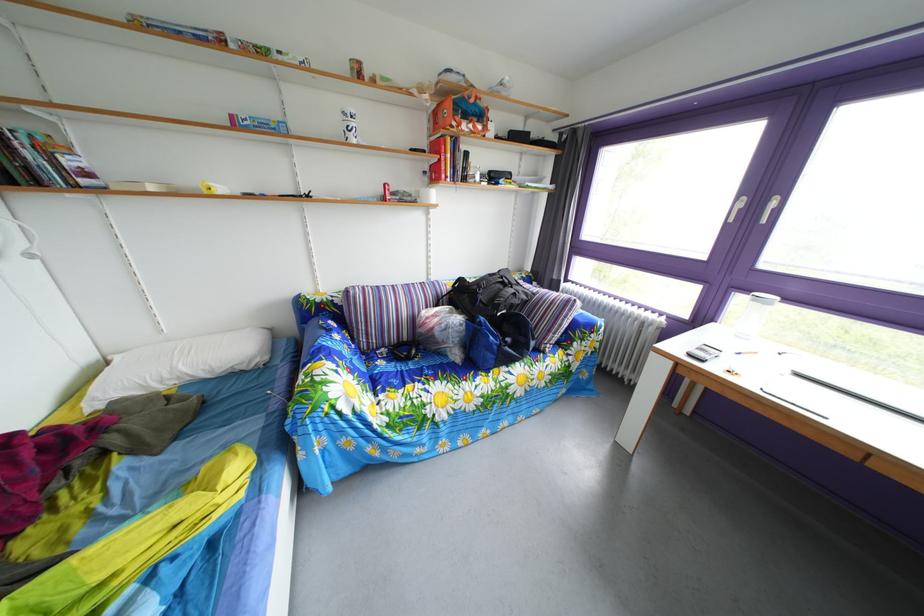
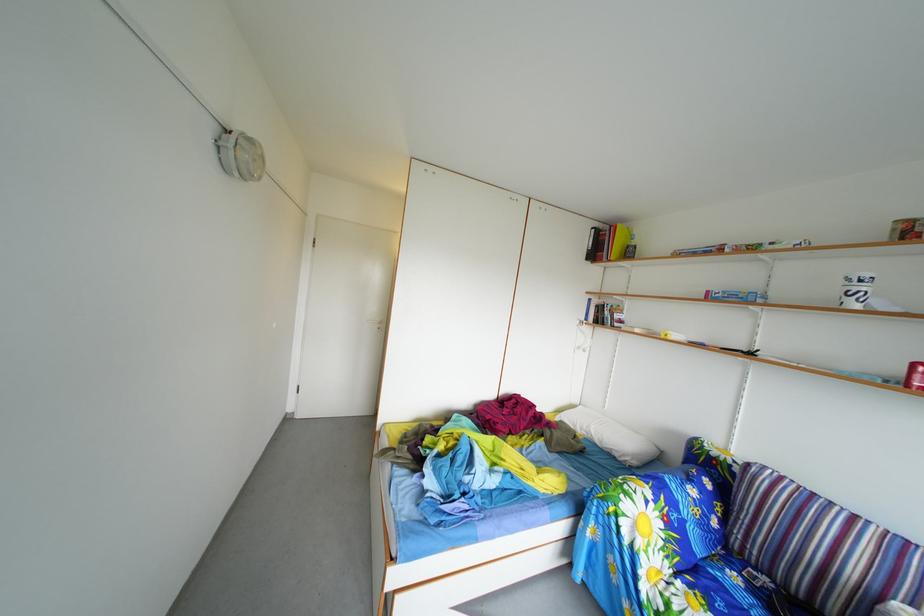
Where in the second image is the point corresponding to point 223,379 from the first image?

(612, 451)